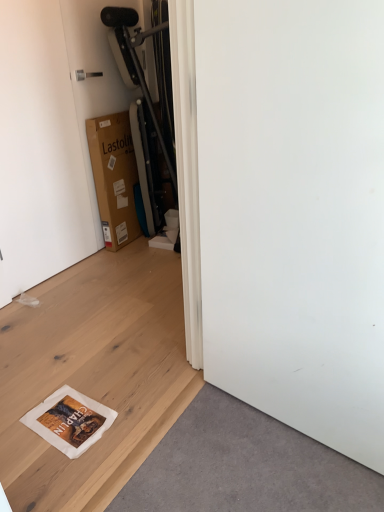
Find the location of a particular element. The image size is (384, 512). vacant space in front of brown cardboard box at upper left is located at coordinates (127, 262).